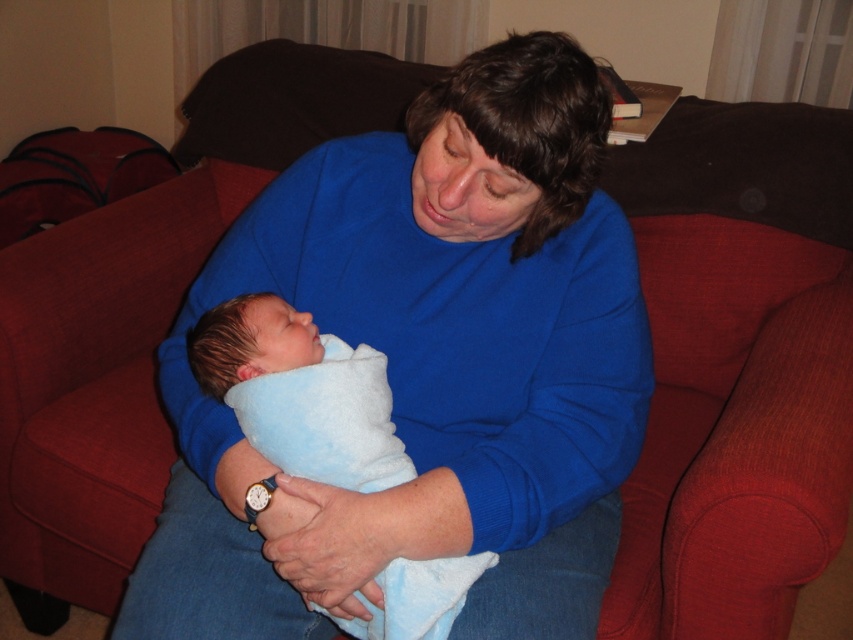
From the picture: You are a photographer setting up for a family photo. You notice the blue soft sweater at center and the blue soft blanket at center in the scene. Which item should you adjust to ensure both are fully visible in the frame?

The blue soft sweater at center is much taller than the blue soft blanket at center, so you should adjust the camera angle or position to accommodate the height of the blue soft sweater at center to ensure both are fully visible.

You are an observer in the room and want to know which item is located to the right when looking at the blue soft sweater at center and the blue soft blanket at center. Which one is on the right?

The blue soft sweater at center is positioned on the right side of the blue soft blanket at center, so the blue soft sweater at center is on the right.

You are a photographer setting up a shoot in this living room. You need to position a small lamp so that it casts a shadow of the blue soft sweater at center onto the blue soft blanket at center. Is this possible based on their current positions?

The blue soft sweater at center is located above the blue soft blanket at center, so positioning a lamp appropriately could cast its shadow onto the blanket below.